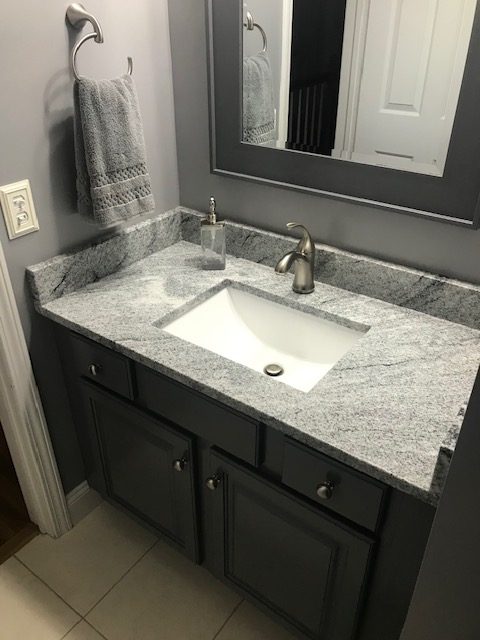
The width and height of the screenshot is (480, 640). Find the location of `sink stopper`. sink stopper is located at coordinates (275, 369).